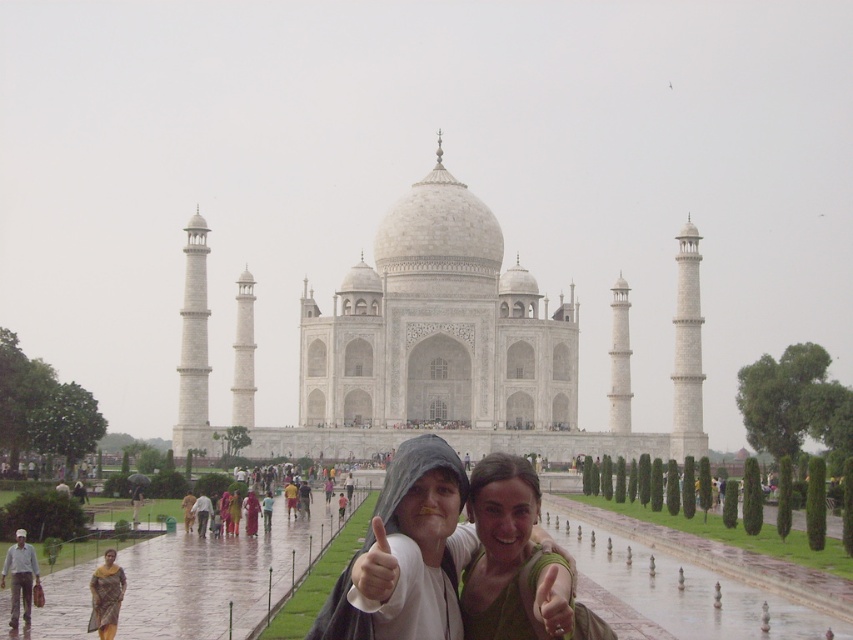
Question: Which of the following is the closest to the observer?

Choices:
 (A) light gray cotton shirt at center
 (B) yellow plaid sari at lower left

Answer: (B)

Question: Is matte white hoodie at center above light gray cotton shirt at center?

Choices:
 (A) no
 (B) yes

Answer: (A)

Question: Which object is the closest to the light gray cotton shirt at lower left?

Choices:
 (A) light gray cotton shirt at center
 (B) matte white hoodie at center

Answer: (B)

Question: Among these points, which one is farthest from the camera?

Choices:
 (A) (206, 497)
 (B) (25, 536)

Answer: (A)

Question: Is light gray cotton shirt at lower left closer to camera compared to matte white hoodie at center?

Choices:
 (A) yes
 (B) no

Answer: (A)

Question: Does yellow plaid sari at lower left appear on the left side of light gray cotton shirt at center?

Choices:
 (A) yes
 (B) no

Answer: (A)